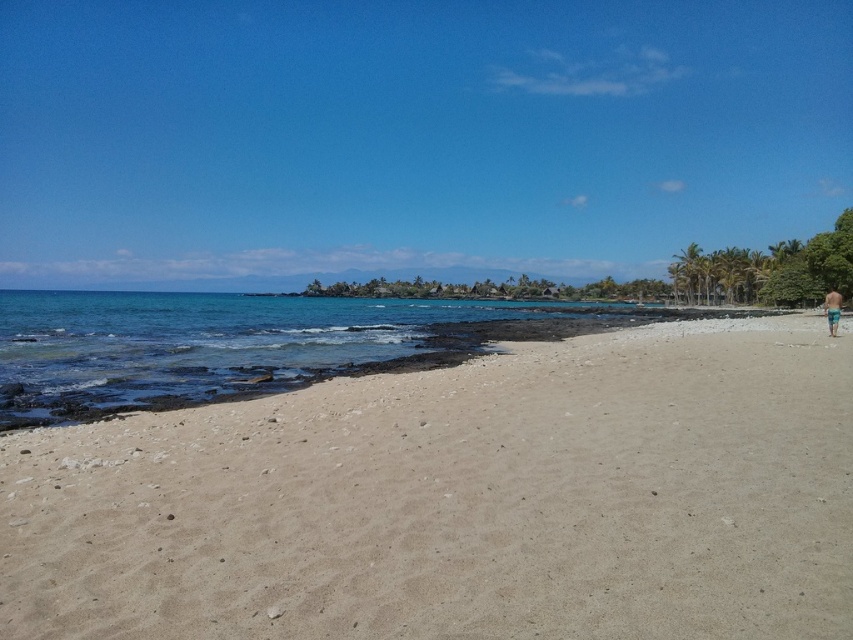
Is light beige sand at center further to camera compared to blue-green striped shorts at right?

No, it is in front of blue-green striped shorts at right.

Who is more forward, (775, 404) or (824, 314)?

Positioned in front is point (775, 404).

Where is `light beige sand at center`? This screenshot has height=640, width=853. light beige sand at center is located at coordinates (459, 500).

Is clear blue water at lower left in front of blue-green striped shorts at right?

Yes.

From the picture: Who is higher up, clear blue water at lower left or blue-green striped shorts at right?

clear blue water at lower left is above.

Is point (49, 385) closer to viewer compared to point (828, 316)?

Yes, point (49, 385) is closer to viewer.

Find the location of a particular element. This screenshot has height=640, width=853. clear blue water at lower left is located at coordinates (230, 342).

Who is positioned more to the left, light beige sand at center or clear blue water at lower left?

clear blue water at lower left

Is light beige sand at center bigger than clear blue water at lower left?

Incorrect, light beige sand at center is not larger than clear blue water at lower left.

Between point (190, 554) and point (200, 340), which one is positioned in front?

Point (190, 554) is in front.

This screenshot has height=640, width=853. What are the coordinates of `light beige sand at center` in the screenshot? It's located at (459, 500).